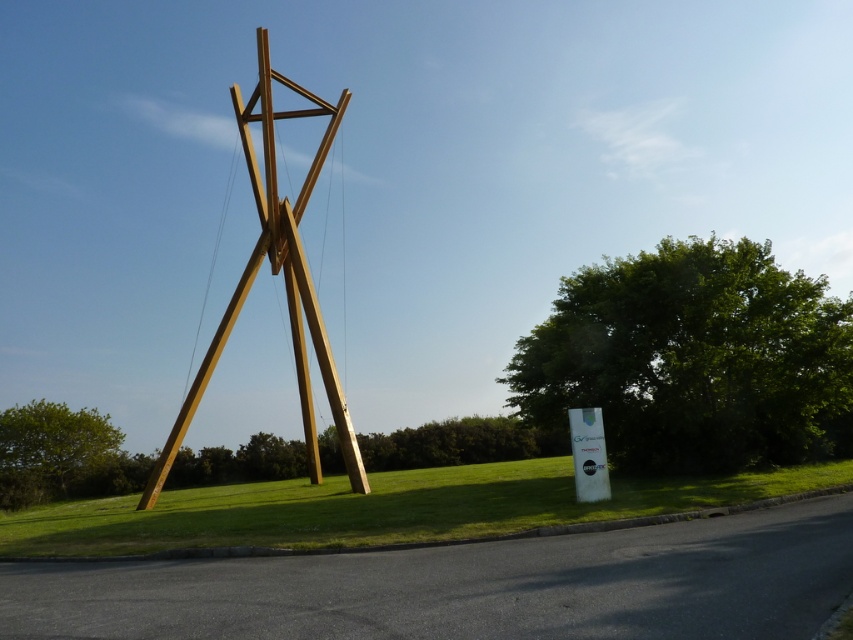
You are a photographer planning to capture the natural wood sculpture at center and the green leafy tree at lower left in a single frame. Given that the sculpture is larger than the tree, where should you position yourself to ensure both subjects are clearly visible in the photo?

To capture both the natural wood sculpture at center and the green leafy tree at lower left clearly, position yourself at a distance where the larger natural wood sculpture at center doesn t overpower the smaller green leafy tree at lower left. This ensures both are visible in the frame.

You are a visitor at the sculpture garden and want to take a photo of both the green grass at center and the natural wood sculpture at center. Since you want them both in the frame, which object should you position closer to the camera to include both?

To include both the green grass at center and the natural wood sculpture at center in the frame, you should position the camera so that the green grass at center is closer to the camera since it is located to the right of the natural wood sculpture at center.